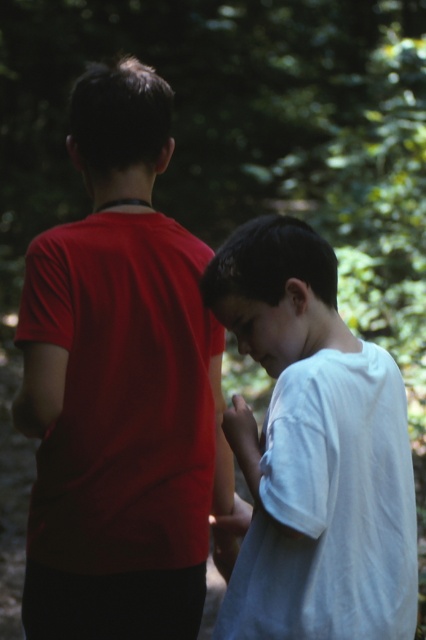
Does matte red t-shirt at left appear on the right side of white cotton shirt at right?

No, matte red t-shirt at left is not to the right of white cotton shirt at right.

Is matte red t-shirt at left thinner than white cotton shirt at right?

In fact, matte red t-shirt at left might be wider than white cotton shirt at right.

What do you see at coordinates (120, 387) in the screenshot? I see `matte red t-shirt at left` at bounding box center [120, 387].

Where is `matte red t-shirt at left`? matte red t-shirt at left is located at coordinates (120, 387).